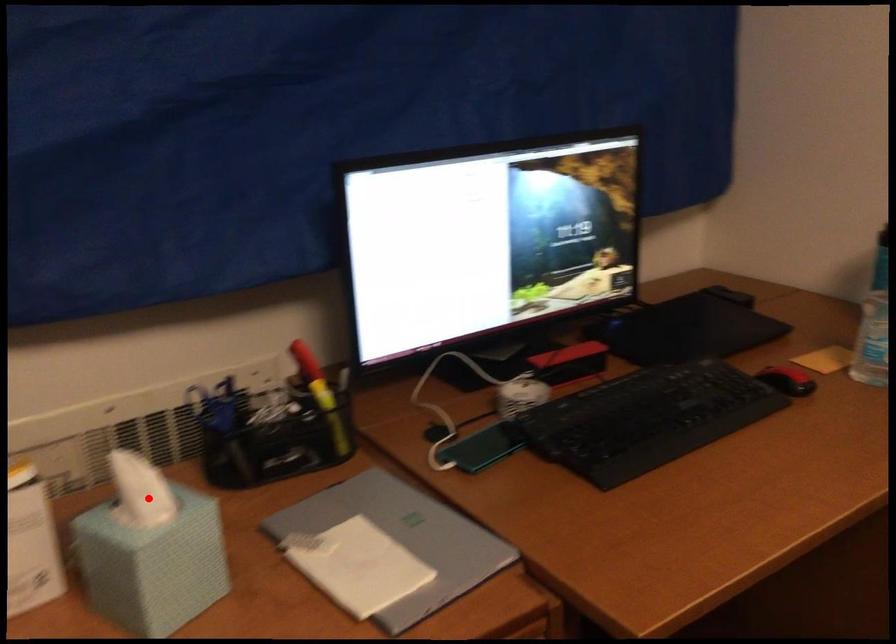
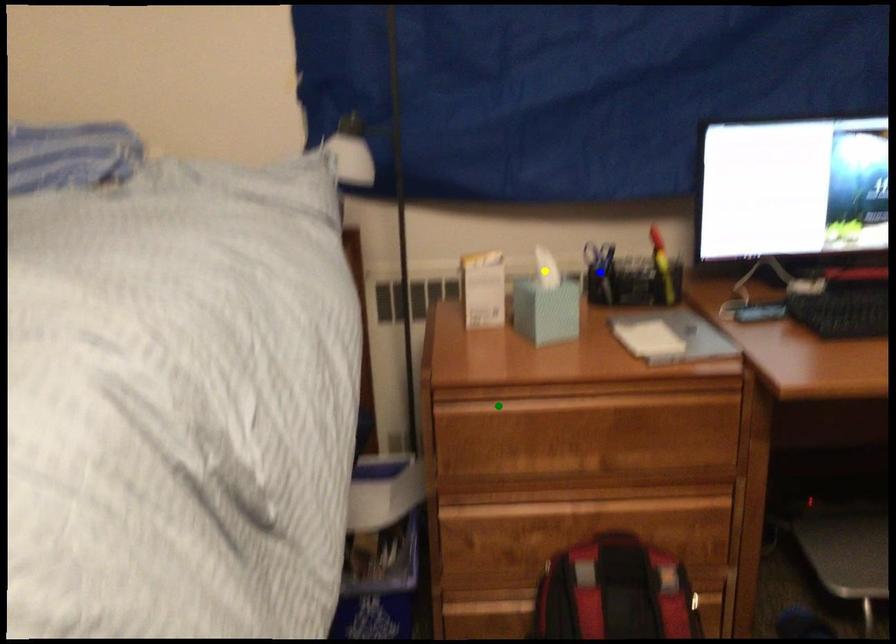
Question: I am providing you with two images of the same scene from different viewpoints. A red point is marked on the first image. You are given multiple points on the second image. Which point in image 2 represents the same 3d spot as the red point in image 1?

Choices:
 (A) yellow point
 (B) green point
 (C) blue point

Answer: (A)